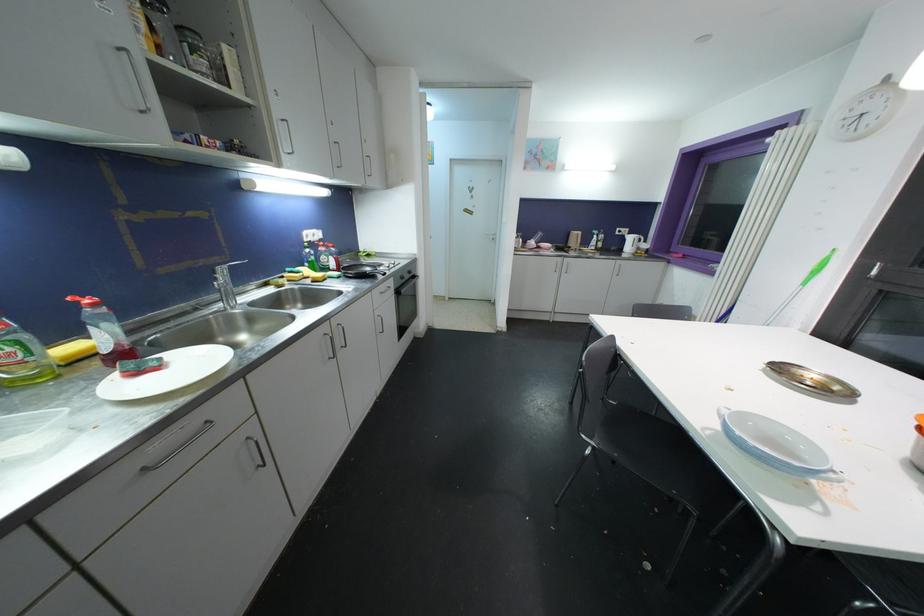
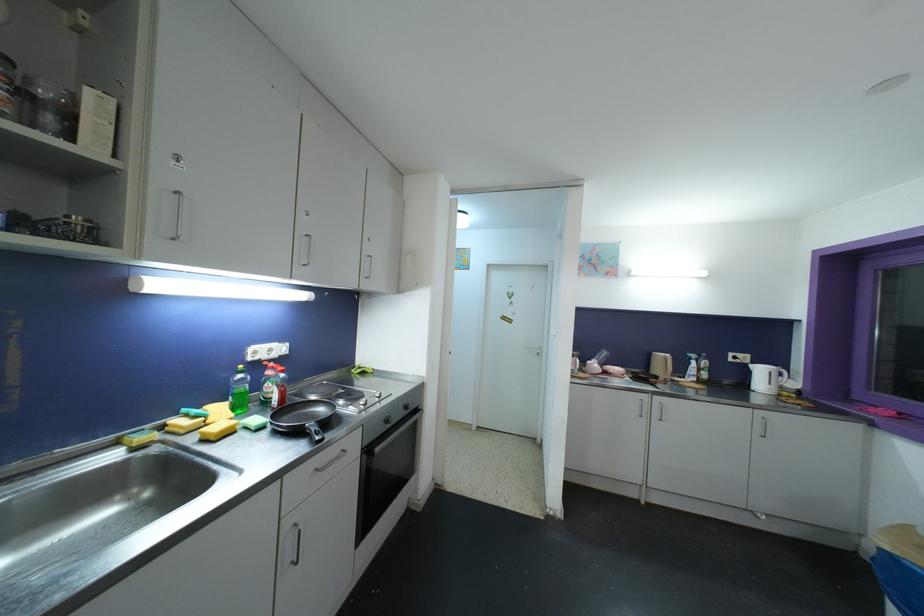
In the second image, find the point that corresponds to pixel 310 253 in the first image.

(244, 379)